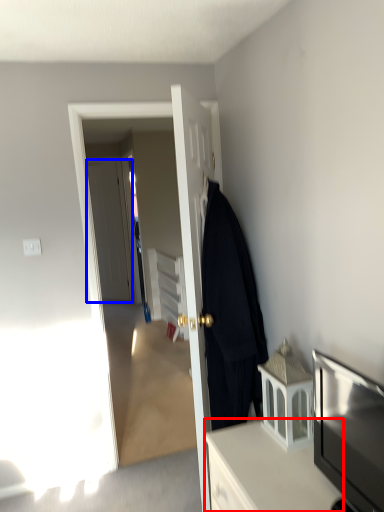
Question: Which point is closer to the camera, cabinetry (highlighted by a red box) or door (highlighted by a blue box)?

Choices:
 (A) cabinetry
 (B) door

Answer: (A)